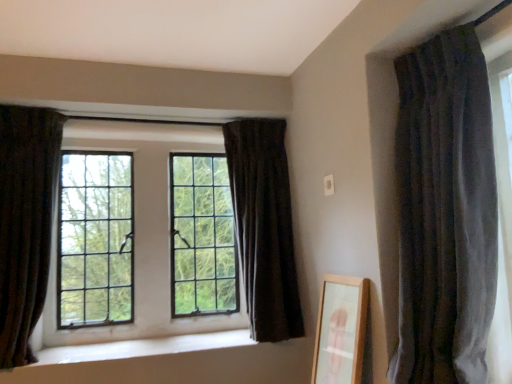
This screenshot has width=512, height=384. What are the coordinates of `wooden framed mirror at lower right` in the screenshot? It's located at (341, 330).

The height and width of the screenshot is (384, 512). I want to click on dark velvet curtain at left, positioned as the second curtain in front-to-back order, so click(25, 222).

I want to click on clear glass window at center, so click(x=142, y=230).

Identify the location of dark velvet curtain at center, the 2th curtain from the left. The width and height of the screenshot is (512, 384). (264, 226).

Is wooden framed mirror at lower right oriented away from white smooth window sill at center?

That's not correct — wooden framed mirror at lower right is not looking away from white smooth window sill at center.

Is wooden framed mirror at lower right bigger or smaller than white smooth window sill at center?

Considering their sizes, wooden framed mirror at lower right takes up more space than white smooth window sill at center.

Are wooden framed mirror at lower right and white smooth window sill at center making contact?

wooden framed mirror at lower right is not next to white smooth window sill at center, and they're not touching.

Which is more to the left, white smooth window sill at center or clear glass window at center?

clear glass window at center.

From the image's perspective, is white smooth window sill at center above clear glass window at center?

No.

Are white smooth window sill at center and clear glass window at center far apart?

They are positioned close to each other.

How different are the orientations of white smooth window sill at center and clear glass window at center in degrees?

There is a 0.00383-degree angle between the facing directions of white smooth window sill at center and clear glass window at center.

In terms of height, does wooden framed mirror at lower right look taller or shorter compared to velvet dark gray curtain at right, which is counted as the third curtain, starting from the back?

In the image, wooden framed mirror at lower right appears to be shorter than velvet dark gray curtain at right, which is counted as the third curtain, starting from the back.

In the scene shown: Could you tell me if wooden framed mirror at lower right is facing velvet dark gray curtain at right, acting as the first curtain starting from the front?

No, wooden framed mirror at lower right does not turn towards velvet dark gray curtain at right, acting as the first curtain starting from the front.

Would you say wooden framed mirror at lower right is a long distance from velvet dark gray curtain at right, which is counted as the third curtain, starting from the back?

No, there isn't a large distance between wooden framed mirror at lower right and velvet dark gray curtain at right, which is counted as the third curtain, starting from the back.

Between wooden framed mirror at lower right and velvet dark gray curtain at right, acting as the first curtain starting from the front, which one has smaller size?

wooden framed mirror at lower right is smaller.

Is dark velvet curtain at left, positioned as the second curtain in front-to-back order, oriented away from white smooth window sill at center?

No, white smooth window sill at center is not at the back of dark velvet curtain at left, positioned as the second curtain in front-to-back order.

Considering the positions of objects dark velvet curtain at left, arranged as the 3th curtain when viewed from the right, and white smooth window sill at center in the image provided, who is more to the right, dark velvet curtain at left, arranged as the 3th curtain when viewed from the right, or white smooth window sill at center?

white smooth window sill at center is more to the right.

From a real-world perspective, between dark velvet curtain at left, arranged as the 3th curtain when viewed from the right, and white smooth window sill at center, who is vertically higher?

From a 3D spatial view, dark velvet curtain at left, arranged as the 3th curtain when viewed from the right, is above.

Who is more distant, dark velvet curtain at left, which is the second curtain in back-to-front order, or white smooth window sill at center?

white smooth window sill at center is further from the camera.

From a real-world perspective, is dark velvet curtain at center, arranged as the third curtain when viewed from the front, positioned under dark velvet curtain at left, which ranks as the 1th curtain in left-to-right order, based on gravity?

Incorrect, from a real-world perspective, dark velvet curtain at center, arranged as the third curtain when viewed from the front, is higher than dark velvet curtain at left, which ranks as the 1th curtain in left-to-right order.

Does dark velvet curtain at center, marked as the second curtain in a right-to-left arrangement, appear on the left side of dark velvet curtain at left, which ranks as the 1th curtain in left-to-right order?

Incorrect, dark velvet curtain at center, marked as the second curtain in a right-to-left arrangement, is not on the left side of dark velvet curtain at left, which ranks as the 1th curtain in left-to-right order.

Is dark velvet curtain at center, marked as the second curtain in a right-to-left arrangement, in contact with dark velvet curtain at left, positioned as the second curtain in front-to-back order?

dark velvet curtain at center, marked as the second curtain in a right-to-left arrangement, is not next to dark velvet curtain at left, positioned as the second curtain in front-to-back order, and they're not touching.

Is velvet dark gray curtain at right, the first curtain from the right, taller than wooden framed mirror at lower right?

Indeed, velvet dark gray curtain at right, the first curtain from the right, has a greater height compared to wooden framed mirror at lower right.

Are velvet dark gray curtain at right, the third curtain from the left, and wooden framed mirror at lower right located far from each other?

velvet dark gray curtain at right, the third curtain from the left, is near wooden framed mirror at lower right, not far away.

Considering the positions of points (445, 227) and (331, 298), is point (445, 227) farther from camera compared to point (331, 298)?

No.

What's the angular difference between velvet dark gray curtain at right, acting as the first curtain starting from the front, and wooden framed mirror at lower right's facing directions?

4.57 degrees.

Does clear glass window at center have a greater width compared to wooden framed mirror at lower right?

No, clear glass window at center is not wider than wooden framed mirror at lower right.

Is point (42, 342) positioned after point (323, 376)?

Yes, it is.

Is clear glass window at center facing towards wooden framed mirror at lower right?

Yes, clear glass window at center is turned towards wooden framed mirror at lower right.

I want to click on window sill that is behind the wooden framed mirror at lower right, so click(x=144, y=347).

This screenshot has height=384, width=512. Find the location of `window sill to the right of clear glass window at center`. window sill to the right of clear glass window at center is located at coordinates (144, 347).

From the image, which object appears to be nearer to velvet dark gray curtain at right, the first curtain from the right, wooden framed mirror at lower right or white smooth window sill at center?

Among the two, wooden framed mirror at lower right is located nearer to velvet dark gray curtain at right, the first curtain from the right.

From the image, which object appears to be farther from wooden framed mirror at lower right, dark velvet curtain at left, positioned as the second curtain in front-to-back order, or white smooth window sill at center?

dark velvet curtain at left, positioned as the second curtain in front-to-back order, lies further to wooden framed mirror at lower right than the other object.

Estimate the real-world distances between objects in this image. Which object is closer to dark velvet curtain at left, which is the second curtain in back-to-front order, dark velvet curtain at center, marked as the second curtain in a right-to-left arrangement, or wooden framed mirror at lower right?

The object closer to dark velvet curtain at left, which is the second curtain in back-to-front order, is dark velvet curtain at center, marked as the second curtain in a right-to-left arrangement.

Looking at this image, considering their positions, is white smooth window sill at center positioned closer to dark velvet curtain at center, marked as the second curtain in a right-to-left arrangement, than wooden framed mirror at lower right?

wooden framed mirror at lower right is positioned closer to the anchor dark velvet curtain at center, marked as the second curtain in a right-to-left arrangement.

Considering their positions, is velvet dark gray curtain at right, acting as the first curtain starting from the front, positioned further to dark velvet curtain at center, arranged as the third curtain when viewed from the front, than white smooth window sill at center?

Based on the image, velvet dark gray curtain at right, acting as the first curtain starting from the front, appears to be further to dark velvet curtain at center, arranged as the third curtain when viewed from the front.

From the image, which object appears to be nearer to white smooth window sill at center, clear glass window at center or dark velvet curtain at center, marked as the second curtain in a right-to-left arrangement?

The object closer to white smooth window sill at center is clear glass window at center.

Looking at the image, which one is located further to wooden framed mirror at lower right, white smooth window sill at center or dark velvet curtain at left, arranged as the 3th curtain when viewed from the right?

Among the two, dark velvet curtain at left, arranged as the 3th curtain when viewed from the right, is located further to wooden framed mirror at lower right.

Which object lies further to the anchor point velvet dark gray curtain at right, the first curtain from the right, clear glass window at center or dark velvet curtain at center, marked as the second curtain in a right-to-left arrangement?

clear glass window at center lies further to velvet dark gray curtain at right, the first curtain from the right, than the other object.

Find the location of a particular element. The image size is (512, 384). curtain situated between dark velvet curtain at left, which ranks as the 1th curtain in left-to-right order, and wooden framed mirror at lower right from left to right is located at coordinates (264, 226).

Where is `window sill between dark velvet curtain at left, positioned as the second curtain in front-to-back order, and dark velvet curtain at center, the 1th curtain in the back-to-front sequence, in the horizontal direction`? Image resolution: width=512 pixels, height=384 pixels. window sill between dark velvet curtain at left, positioned as the second curtain in front-to-back order, and dark velvet curtain at center, the 1th curtain in the back-to-front sequence, in the horizontal direction is located at coordinates (144, 347).

Locate an element on the screen. window sill between dark velvet curtain at left, arranged as the 3th curtain when viewed from the right, and velvet dark gray curtain at right, the first curtain from the right is located at coordinates (144, 347).

Where is `window sill between clear glass window at center and wooden framed mirror at lower right in the horizontal direction`? This screenshot has width=512, height=384. window sill between clear glass window at center and wooden framed mirror at lower right in the horizontal direction is located at coordinates (144, 347).